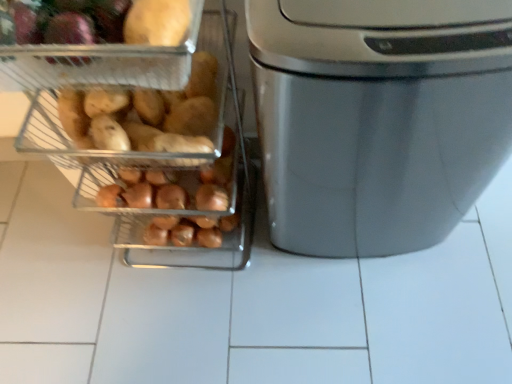
This screenshot has height=384, width=512. I want to click on empty space that is in between metallic silver trash can at right and satin silver trash can at right, so click(312, 266).